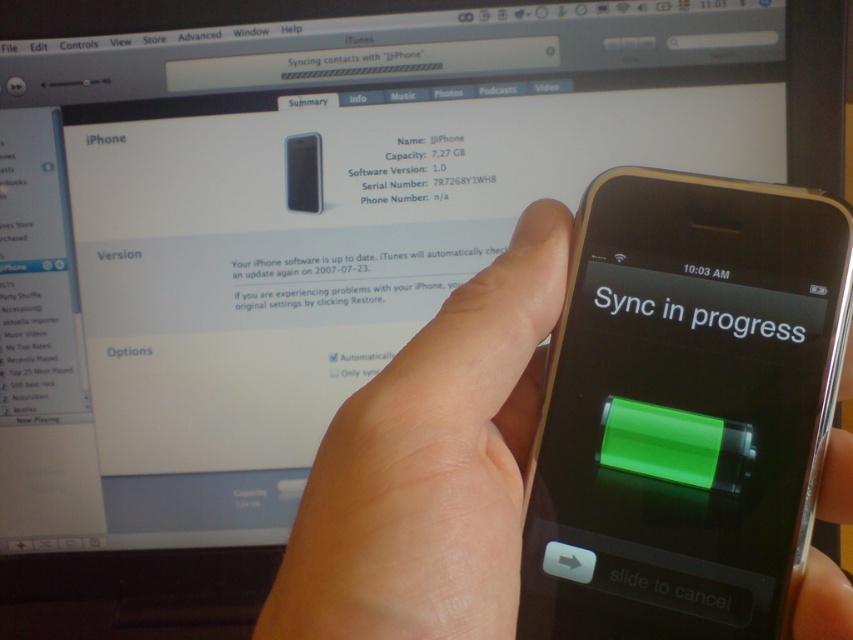
You are trying to determine if the skinny white hand at center can fully cover the green matte text at center on the phone screen. Based on the scene, can the hand cover the text without any part of the text being visible?

The skinny white hand at center is wider than the green matte text at center, so yes, the hand can fully cover the text without any part of it being visible.

What are the coordinates of the black matte iPhone at center in the image?

The black matte iPhone at center is located at coordinates point (416, 172).